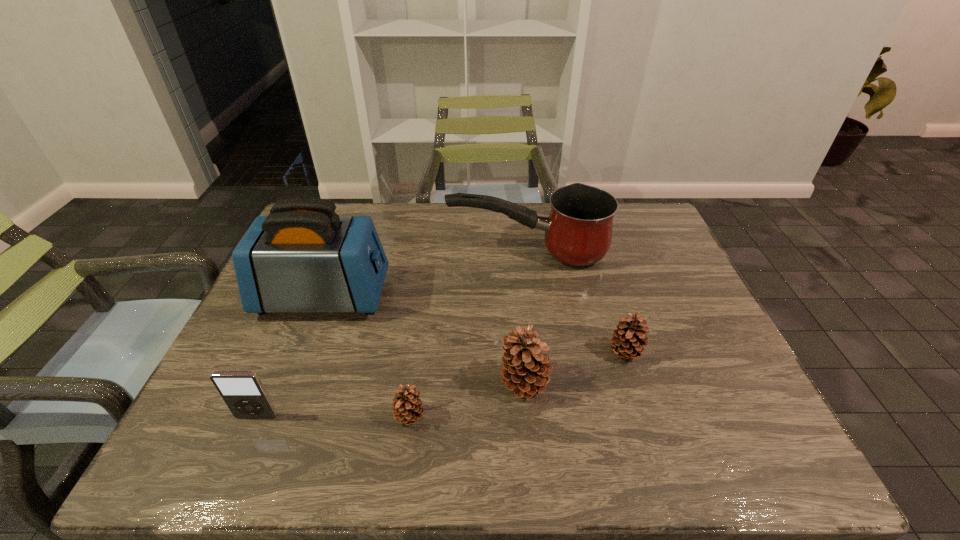
Where is `the fourth object from right to left`? the fourth object from right to left is located at coordinates tap(406, 404).

This screenshot has height=540, width=960. In order to click on the leftmost pinecone in this screenshot , I will do `click(406, 404)`.

Where is `the tallest pinecone`? The width and height of the screenshot is (960, 540). the tallest pinecone is located at coordinates (525, 370).

Identify the location of the fifth tallest object. The height and width of the screenshot is (540, 960). (628, 339).

Locate an element on the screen. The image size is (960, 540). the rightmost pinecone is located at coordinates (628, 339).

Find the location of a particular element. The height and width of the screenshot is (540, 960). saucepan is located at coordinates (578, 231).

Locate an element on the screen. The width and height of the screenshot is (960, 540). the tallest object is located at coordinates (303, 257).

Where is `iPod`? The height and width of the screenshot is (540, 960). iPod is located at coordinates (243, 392).

In order to click on free point located on the back of the leftmost pinecone in this screenshot , I will do `click(422, 324)`.

Locate an element on the screen. The image size is (960, 540). vacant space located 0.370m on the back of the tallest pinecone is located at coordinates (514, 262).